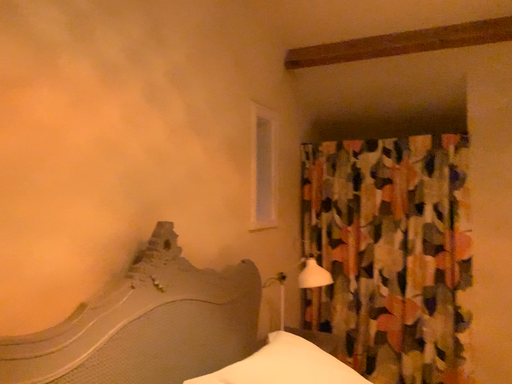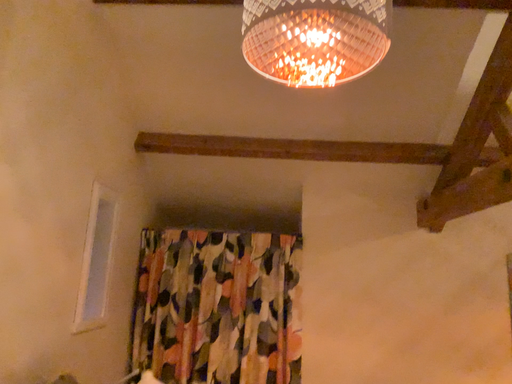
Question: How did the camera likely rotate when shooting the video?

Choices:
 (A) rotated downward
 (B) rotated upward

Answer: (B)